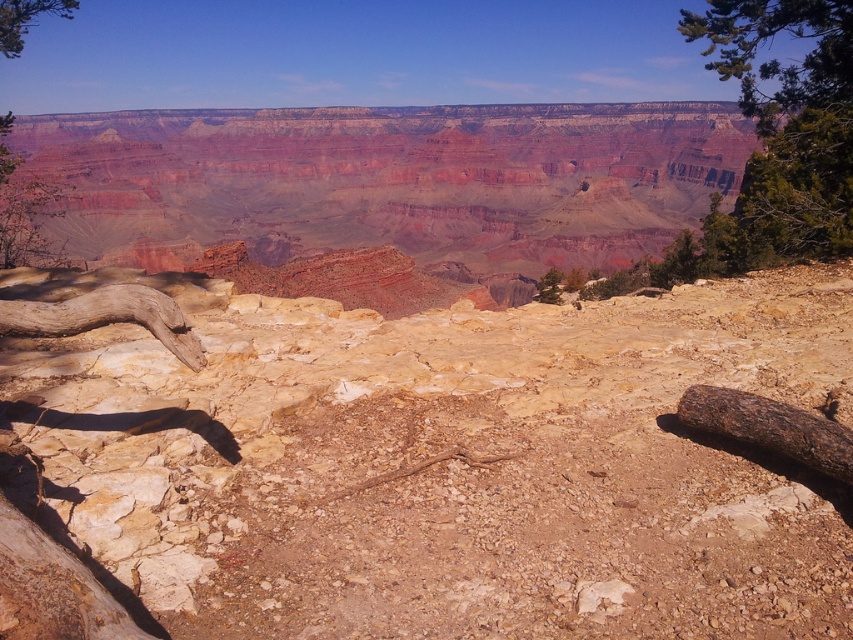
You are a hiker who wants to take a photo of the Grand Canyon. You have a camera that can focus on objects at a distance. Which object, the brown rough log at right or the green leafy tree at upper left, should you focus on to capture the foreground element in your photo?

The brown rough log at right is in front of the green leafy tree at upper left, so focusing on the brown rough log at right will capture the foreground element.

Consider the image. You are a hiker planning to cross the Grand Canyon using the path between the brown rough log at right and the brown rough tree trunk at left. The log is 1.5 meters wide. Can you safely walk across the gap between them?

The brown rough log at right is larger than the brown rough tree trunk at left. Since the log is 1.5 meters wide, the gap between them may be manageable for a hiker to cross safely, but caution is advised due to the uneven terrain and potential instability of the log.

You are a hiker standing at the edge of the Grand Canyon and see the brown rough log at right. If you want to take a photo of the log with the entire Grand Canyon in the background, where should you position yourself relative to the log?

The brown rough log at right is located at point (770, 426) in the image. To include the entire Grand Canyon in the background while focusing on the log, position yourself slightly to the left of the log to ensure the vast canyon landscape is fully captured in the frame.